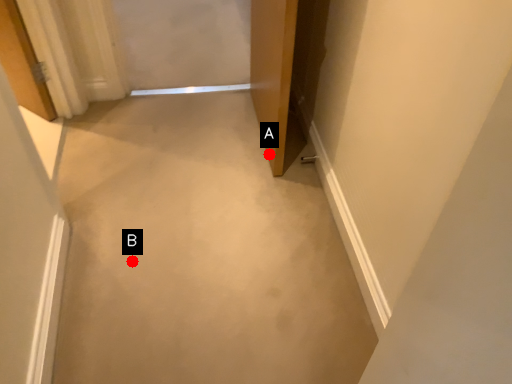
Question: Two points are circled on the image, labeled by A and B beside each circle. Which point appears closest to the camera in this image?

Choices:
 (A) A is closer
 (B) B is closer

Answer: (B)